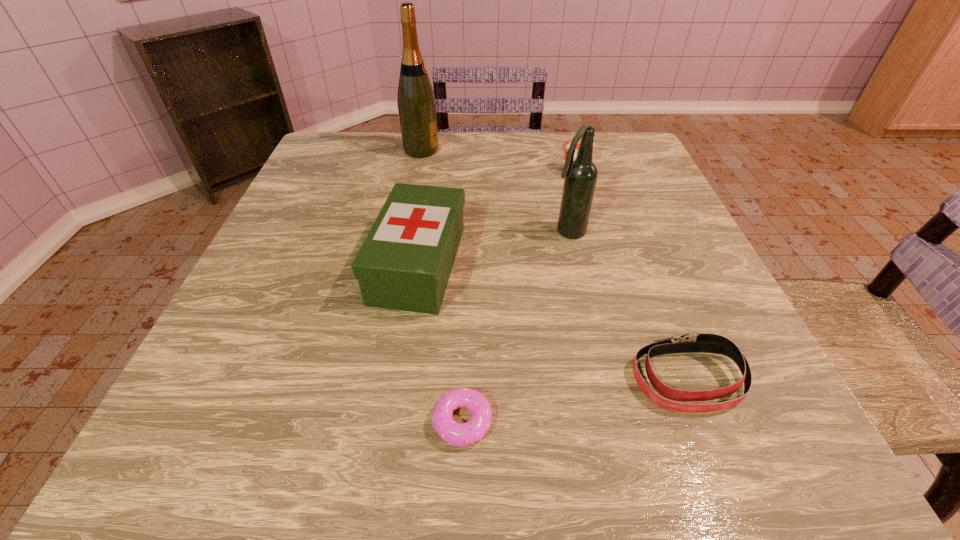
This screenshot has height=540, width=960. I want to click on free space between the second shortest object and the doughnut, so click(x=575, y=400).

This screenshot has height=540, width=960. Identify the location of free space between the first-aid kit and the fifth shortest object. click(493, 248).

Where is `free space between the second shortest object and the farthest object`? This screenshot has height=540, width=960. free space between the second shortest object and the farthest object is located at coordinates (555, 265).

This screenshot has height=540, width=960. Find the location of `vacant space that is in between the first-aid kit and the fifth nearest object`. vacant space that is in between the first-aid kit and the fifth nearest object is located at coordinates (497, 217).

I want to click on free space between the shortest object and the dog collar, so click(575, 400).

The height and width of the screenshot is (540, 960). I want to click on free space between the fifth shortest object and the first-aid kit, so click(x=493, y=248).

In order to click on object identified as the third closest to the shortest object in this screenshot , I will do `click(581, 174)`.

This screenshot has height=540, width=960. I want to click on object that is the third closest to the dog collar, so click(x=405, y=261).

Find the location of a particular element. The width and height of the screenshot is (960, 540). free space that satisfies the following two spatial constraints: 1. on the front-facing side of the tallest object; 2. on the right side of the shortest object is located at coordinates (368, 421).

This screenshot has height=540, width=960. What are the coordinates of `free space that satisfies the following two spatial constraints: 1. on the back side of the beer bottle; 2. on the front-facing side of the tallest object` in the screenshot? It's located at (549, 150).